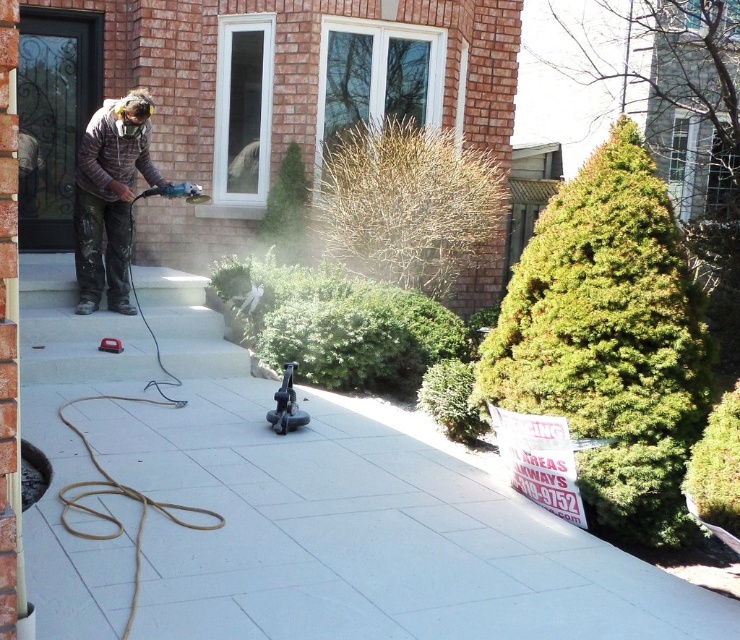
You are standing in the residential outdoor scene. There is a point marked at coordinate (185, 465). If you want to place a 1.5 meter long tool on the ground, will it fit entirely within the paved area without crossing the edges?

The point at coordinate (185, 465) is 4.38 meters away from the viewer. However, without knowing the dimensions of the paved area or the distance from the point to the edges, it is impossible to determine if the 1.5 meter long tool will fit entirely within the paved area without crossing the edges.

You need to place a new potted plant between the white concrete pavement at center and the camouflage jacket at center. Which object should the plant be closer to based on their sizes?

The white concrete pavement at center is larger in size than the camouflage jacket at center, so the plant should be placed closer to the camouflage jacket at center to maintain balance.